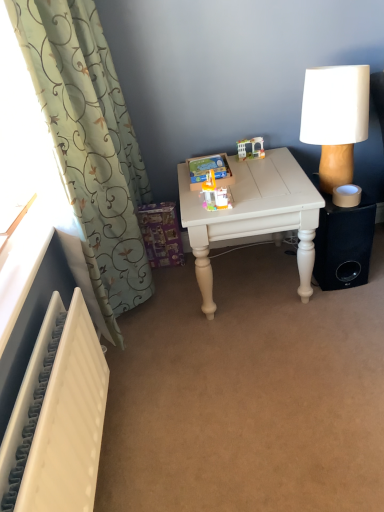
Where is `vacant space that's between white painted wood table at center and white textured radiator at lower left`? Image resolution: width=384 pixels, height=512 pixels. vacant space that's between white painted wood table at center and white textured radiator at lower left is located at coordinates (195, 376).